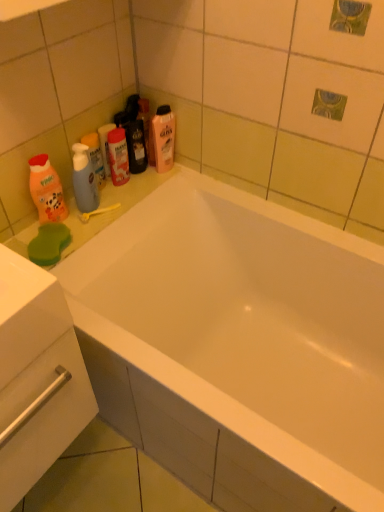
Question: Is orange matte bottle at left, placed as the 1th cleaning product when sorted from left to right, closer to camera compared to translucent plastic mouthwash at upper center, marked as the second mouthwash in a left-to-right arrangement?

Choices:
 (A) no
 (B) yes

Answer: (B)

Question: Considering the relative sizes of orange matte bottle at left, arranged as the 2th cleaning product when viewed from the back, and translucent plastic mouthwash at upper center, marked as the first mouthwash in a right-to-left arrangement, in the image provided, is orange matte bottle at left, arranged as the 2th cleaning product when viewed from the back, wider than translucent plastic mouthwash at upper center, marked as the first mouthwash in a right-to-left arrangement,?

Choices:
 (A) no
 (B) yes

Answer: (B)

Question: Can you confirm if orange matte bottle at left, arranged as the 2th cleaning product when viewed from the back, is taller than translucent plastic mouthwash at upper center, marked as the second mouthwash in a left-to-right arrangement?

Choices:
 (A) no
 (B) yes

Answer: (B)

Question: Is orange matte bottle at left, the 2th cleaning product from the top, thinner than translucent plastic mouthwash at upper center, marked as the second mouthwash in a left-to-right arrangement?

Choices:
 (A) no
 (B) yes

Answer: (A)

Question: Is orange matte bottle at left, positioned as the first cleaning product in front-to-back order, to the left of translucent plastic mouthwash at upper center, marked as the second mouthwash in a left-to-right arrangement, from the viewer's perspective?

Choices:
 (A) yes
 (B) no

Answer: (A)

Question: Considering the positions of white glossy bathtub at center and white glossy drawer at lower left in the image, is white glossy bathtub at center wider or thinner than white glossy drawer at lower left?

Choices:
 (A) thin
 (B) wide

Answer: (B)

Question: Does point (183, 290) appear closer or farther from the camera than point (23, 439)?

Choices:
 (A) closer
 (B) farther

Answer: (B)

Question: From a real-world perspective, is white glossy bathtub at center positioned above or below white glossy drawer at lower left?

Choices:
 (A) above
 (B) below

Answer: (B)

Question: From the image's perspective, relative to white glossy drawer at lower left, is white glossy bathtub at center above or below?

Choices:
 (A) above
 (B) below

Answer: (B)

Question: Do you think yellow plastic toothbrush at upper left is within white glossy drawer at lower left, or outside of it?

Choices:
 (A) outside
 (B) inside

Answer: (A)

Question: From a real-world perspective, relative to white glossy drawer at lower left, is yellow plastic toothbrush at upper left vertically above or below?

Choices:
 (A) above
 (B) below

Answer: (B)

Question: Relative to white glossy drawer at lower left, is yellow plastic toothbrush at upper left in front or behind?

Choices:
 (A) front
 (B) behind

Answer: (B)

Question: In the image, is yellow plastic toothbrush at upper left on the left side or the right side of white glossy drawer at lower left?

Choices:
 (A) right
 (B) left

Answer: (A)

Question: Visually, is translucent plastic bottle at upper center, which appears as the first cleaning product when viewed from the right, positioned to the left or to the right of translucent plastic mouthwash at upper center, marked as the first mouthwash in a right-to-left arrangement?

Choices:
 (A) right
 (B) left

Answer: (A)

Question: Is point (155, 145) positioned closer to the camera than point (109, 157)?

Choices:
 (A) closer
 (B) farther

Answer: (B)